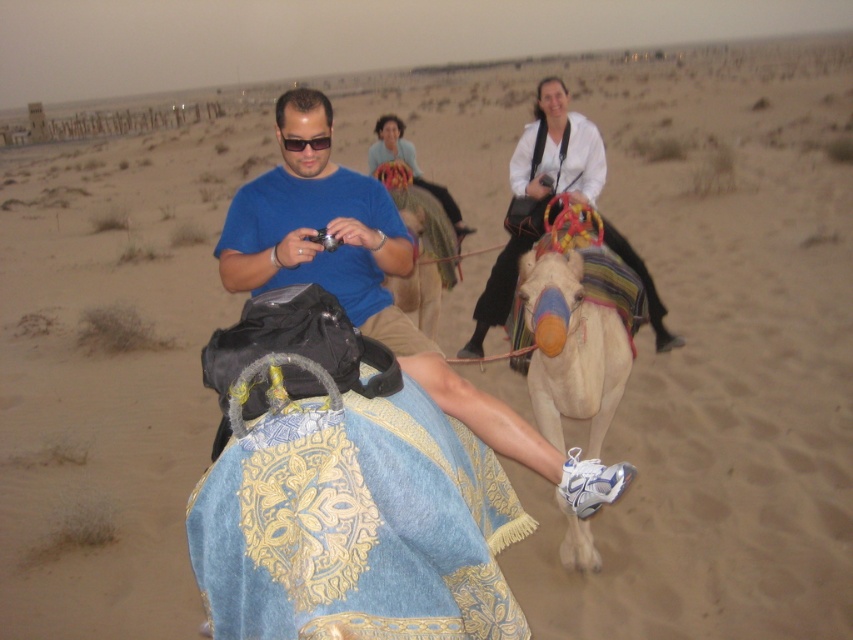
You are a photographer trying to capture the camel rider in the image. Since you want to ensure the white fabric camel at center and sunglasses at center are both clearly visible in your shot, which object should you focus on first to ensure depth of field? Explain your reasoning based on their sizes.

The white fabric camel at center is larger in size than sunglasses at center. To ensure both are in focus, you should focus on the larger object, the white fabric camel at center, as depth of field is more critical for larger subjects to maintain clarity throughout their entire form.

You are a photographer trying to capture the camel rider in the scene. The light beige fabric camel at center and sunglasses at center are both in your viewfinder. According to the spatial arrangement, which object is positioned to the right of the other?

The light beige fabric camel at center is to the right of sunglasses at center.